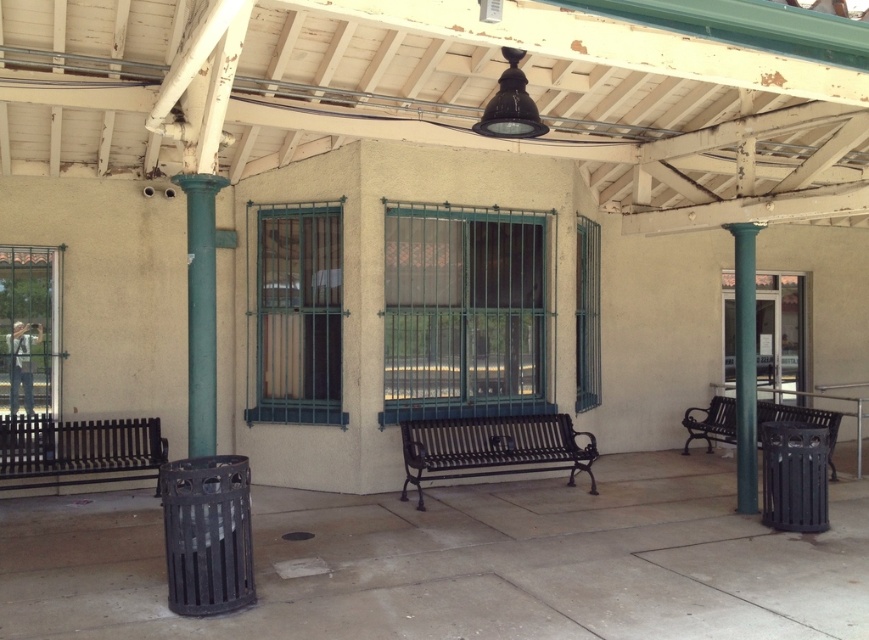
Question: Considering the real-world distances, which object is closest to the black metal bench at right?

Choices:
 (A) black metal bench at left
 (B) green painted metal column at right

Answer: (B)

Question: Can you confirm if black wrought iron bench at center is thinner than black metal bench at left?

Choices:
 (A) yes
 (B) no

Answer: (B)

Question: Does green painted metal column at right lie behind black metal bench at right?

Choices:
 (A) yes
 (B) no

Answer: (B)

Question: Which of the following is the closest to the observer?

Choices:
 (A) black metal bench at left
 (B) green painted metal column at right

Answer: (A)

Question: Is black wrought iron bench at center below green painted metal column at right?

Choices:
 (A) no
 (B) yes

Answer: (B)

Question: Which point is farther to the camera?

Choices:
 (A) black wrought iron bench at center
 (B) green painted metal column at right
 (C) black metal bench at right

Answer: (C)